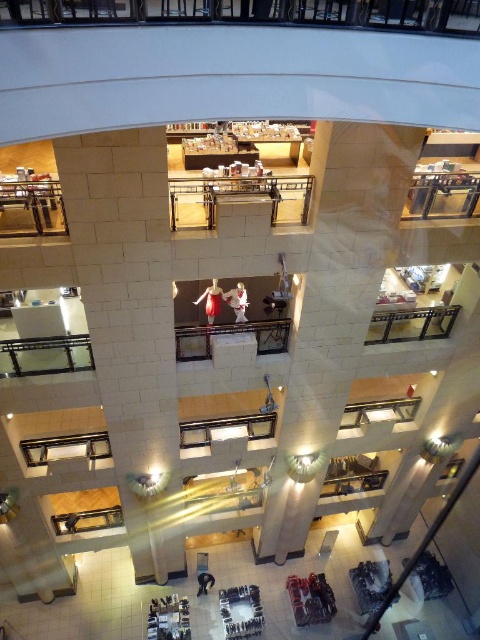
Question: Which object appears closest to the camera in this image?

Choices:
 (A) white marble pillar at center
 (B) matte red dress at center

Answer: (A)

Question: Which object appears closest to the camera in this image?

Choices:
 (A) white fabric dress at center
 (B) matte red dress at center
 (C) white stone pillar at center
 (D) white marble pillar at center

Answer: (C)

Question: Is white marble pillar at center below white fabric dress at center?

Choices:
 (A) no
 (B) yes

Answer: (B)

Question: Which object is farther from the camera taking this photo?

Choices:
 (A) white stone pillar at center
 (B) white fabric dress at center
 (C) white marble pillar at center
 (D) matte red dress at center

Answer: (D)

Question: Is white stone pillar at center below white marble pillar at center?

Choices:
 (A) yes
 (B) no

Answer: (A)

Question: Does white marble pillar at center have a greater width compared to white fabric dress at center?

Choices:
 (A) yes
 (B) no

Answer: (A)